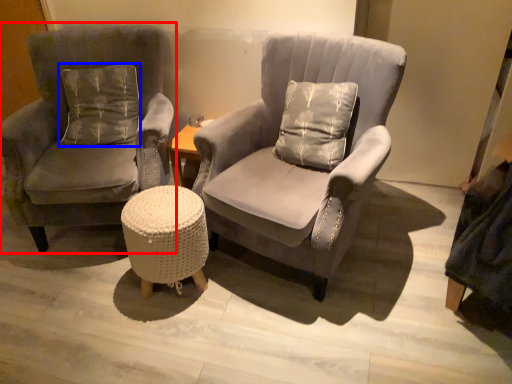
Question: Which object appears farthest to the camera in this image, chair (highlighted by a red box) or pillow (highlighted by a blue box)?

Choices:
 (A) chair
 (B) pillow

Answer: (B)